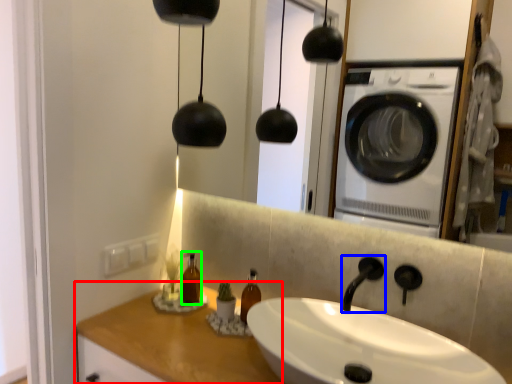
Question: Which object is positioned closest to counter top (highlighted by a red box)? Select from faucet (highlighted by a blue box) and bottle (highlighted by a green box).

Choices:
 (A) faucet
 (B) bottle

Answer: (B)